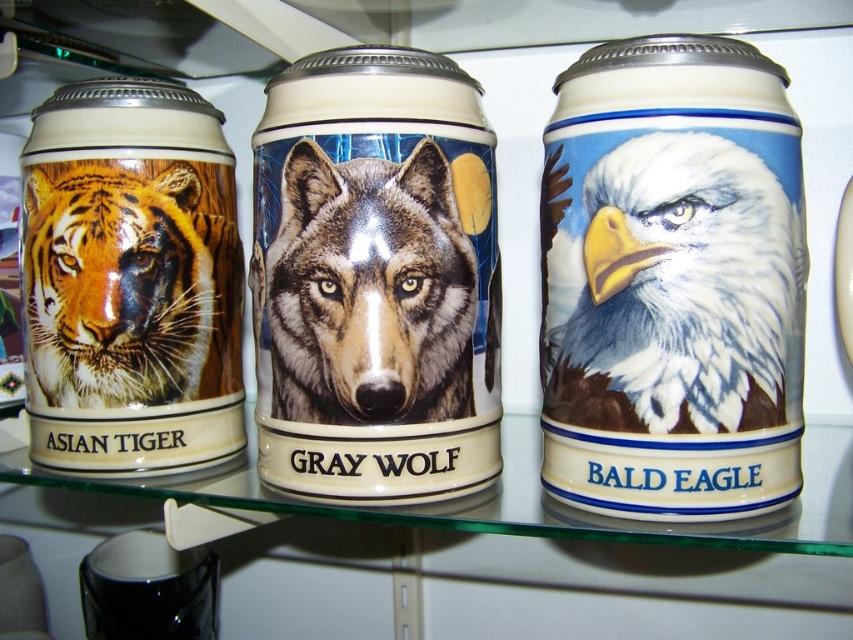
Can you confirm if white glossy bald eagle at center is bigger than matte ceramic tiger at left?

Yes, white glossy bald eagle at center is bigger than matte ceramic tiger at left.

Who is more forward, (621, 200) or (65, 216)?

Point (621, 200) is in front.

Where is `white glossy bald eagle at center`? Image resolution: width=853 pixels, height=640 pixels. white glossy bald eagle at center is located at coordinates (672, 289).

Can you confirm if glossy ceramic mug at center is positioned above matte ceramic tiger at left?

Yes.

Who is more forward, (386, 252) or (158, 396)?

Point (386, 252) is in front.

Find the location of a particular element. glossy ceramic mug at center is located at coordinates (375, 276).

Is glossy ceramic mug at center thinner than white glossy bald eagle at center?

Incorrect, glossy ceramic mug at center's width is not less than white glossy bald eagle at center's.

Which is above, glossy ceramic mug at center or white glossy bald eagle at center?

glossy ceramic mug at center

Locate an element on the screen. This screenshot has width=853, height=640. glossy ceramic mug at center is located at coordinates (375, 276).